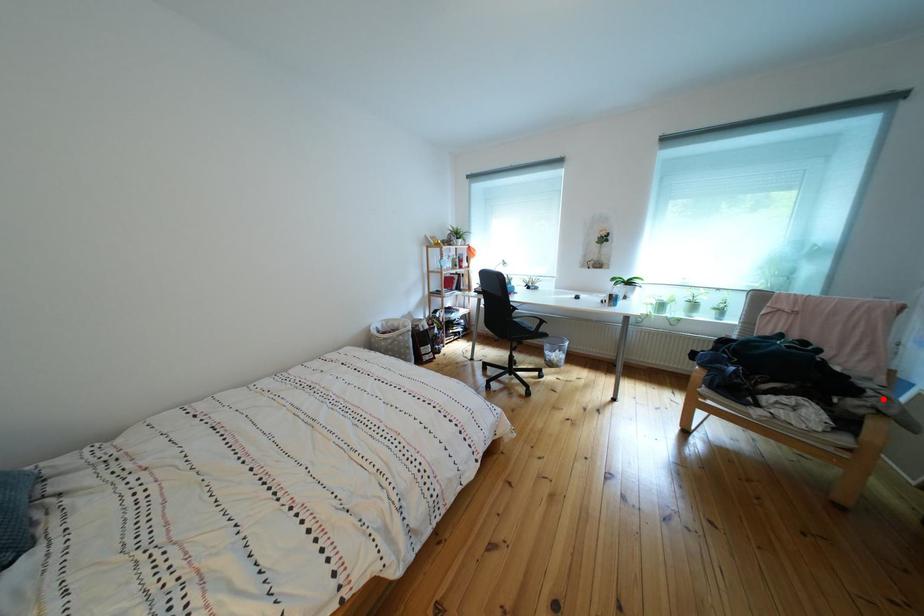
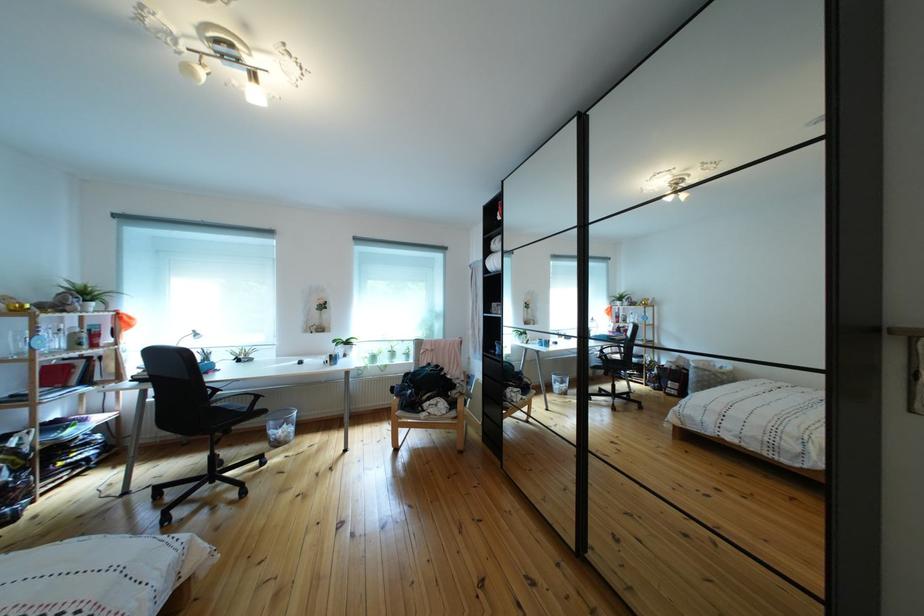
Question: I am providing you with two images of the same scene from different viewpoints. Given a red point in image1, look at the same physical point in image2. Is it:

Choices:
 (A) Closer to the viewpoint
 (B) Farther from the viewpoint

Answer: (B)